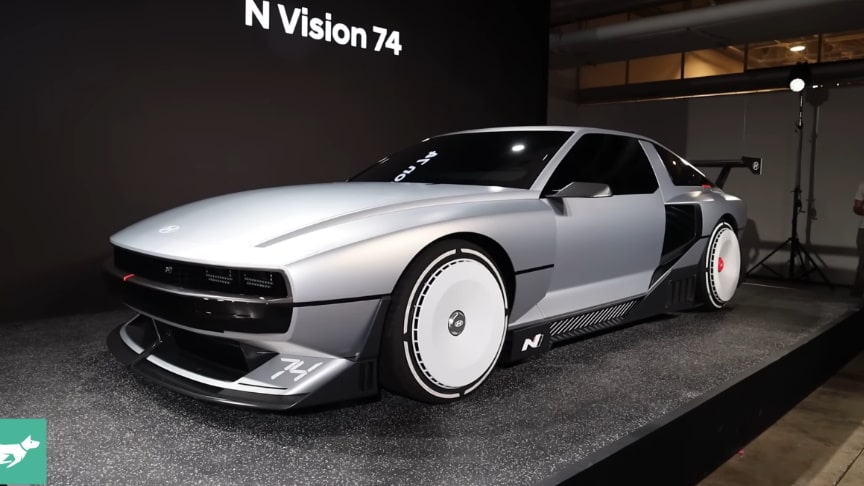
Identify the location of back window. The width and height of the screenshot is (864, 486). (683, 175).